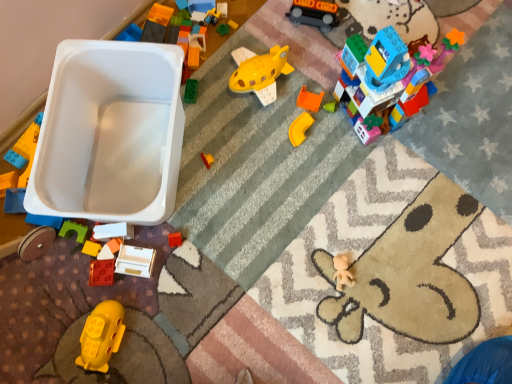
Find the location of a particular element. This screenshot has height=384, width=512. vacant space that is in between white matte block at lower left, the fourth toy from the top, and yellow matte toy submarine at lower left, which is the first toy from bottom to top is located at coordinates (109, 278).